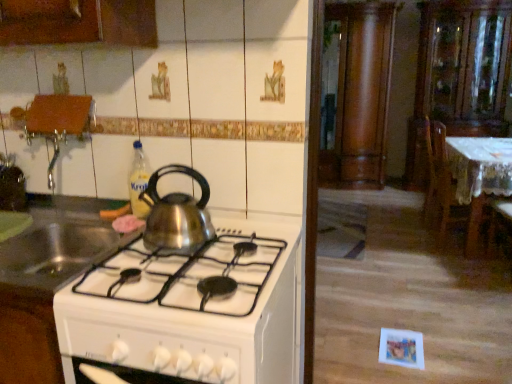
Question: Is wooden chair at right wider or thinner than satin silver kettle at center, acting as the second kitchen appliance starting from the right?

Choices:
 (A) wide
 (B) thin

Answer: (B)

Question: From the image's perspective, is wooden chair at right positioned above or below satin silver kettle at center, acting as the second kitchen appliance starting from the right?

Choices:
 (A) below
 (B) above

Answer: (B)

Question: Estimate the real-world distances between objects in this image. Which object is farther from the white lace tablecloth at right?

Choices:
 (A) shiny metallic kettle at center, the first kitchen appliance in the left-to-right sequence
 (B) translucent plastic bottle at upper center
 (C) shiny metallic kettle at center, which is the 3th kitchen appliance from left to right
 (D) transparent glass cabinet at upper right, which is the first cabinetry from right to left
 (E) wooden column at center, marked as the 2th cabinetry in a right-to-left arrangement

Answer: (C)

Question: Which object is the closest to the shiny metallic kettle at center, which appears as the 1th kitchen appliance when viewed from the right?

Choices:
 (A) transparent glass cabinet at upper right, which is the first cabinetry from right to left
 (B) satin silver kettle at center, acting as the second kitchen appliance starting from the right
 (C) shiny metallic kettle at center, the first kitchen appliance in the left-to-right sequence
 (D) wooden column at center, which is the first cabinetry in left-to-right order
 (E) translucent plastic bottle at upper center

Answer: (C)